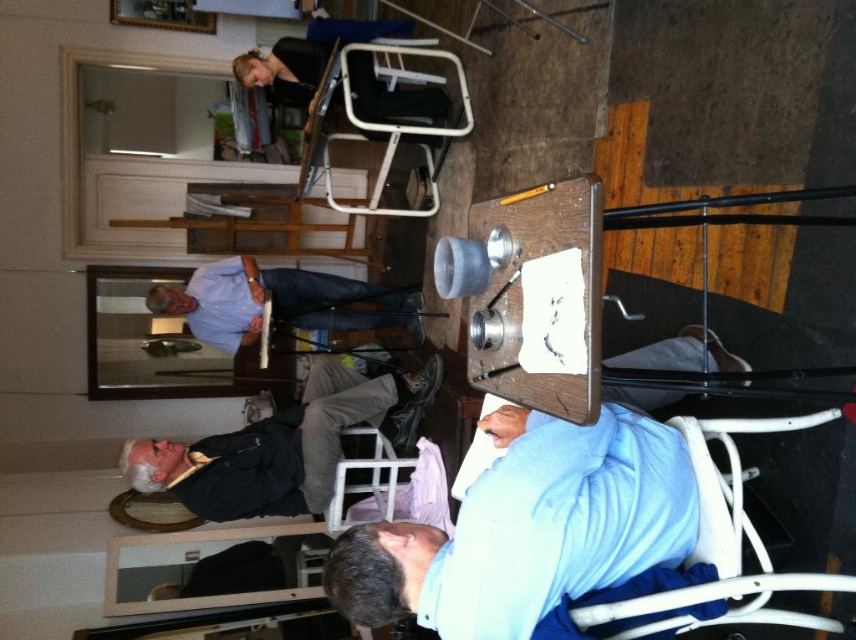
Question: Among these objects, which one is nearest to the camera?

Choices:
 (A) blue shirt at center
 (B) blue cotton shirt at lower right
 (C) white plastic chair at lower right

Answer: (B)

Question: Can you confirm if white plastic chair at lower right is positioned to the right of blue shirt at center?

Choices:
 (A) no
 (B) yes

Answer: (B)

Question: Among these objects, which one is nearest to the camera?

Choices:
 (A) black leather jacket at lower left
 (B) blue cotton shirt at lower right
 (C) blue shirt at center

Answer: (B)

Question: Is blue cotton shirt at lower right above black leather jacket at lower left?

Choices:
 (A) no
 (B) yes

Answer: (B)

Question: Which object appears farthest from the camera in this image?

Choices:
 (A) blue cotton shirt at lower right
 (B) blue shirt at center
 (C) white plastic chair at lower right

Answer: (B)

Question: Can you confirm if blue cotton shirt at lower right is thinner than white plastic chair at lower right?

Choices:
 (A) no
 (B) yes

Answer: (A)